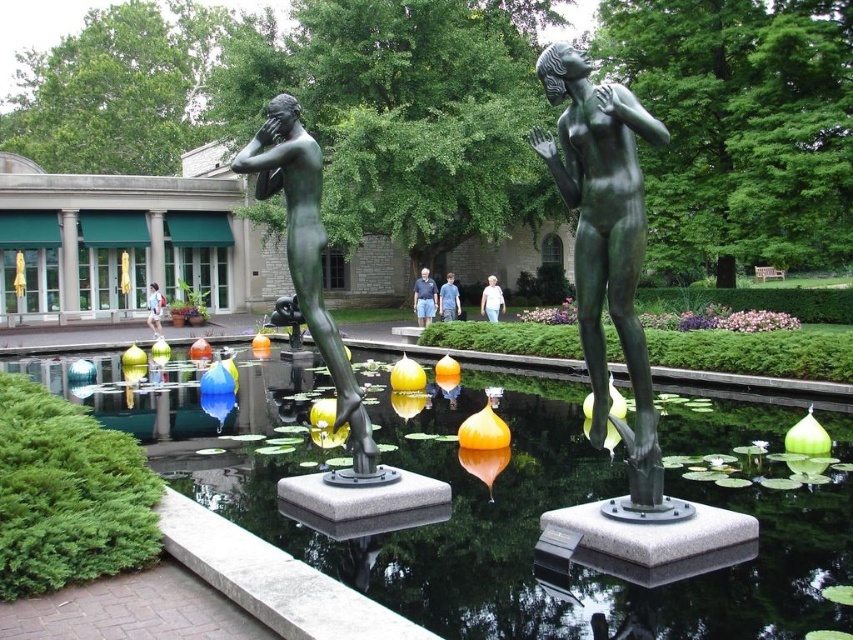
Is glossy concrete pond at center below blue jeans at center?

Indeed, glossy concrete pond at center is positioned under blue jeans at center.

This screenshot has height=640, width=853. Find the location of `glossy concrete pond at center`. glossy concrete pond at center is located at coordinates (505, 497).

You are a GUI agent. You are given a task and a screenshot of the screen. Output one action in this format:
    pyautogui.click(x=<x>, y=<y>)
    Task: Click on the glossy concrete pond at center
    This screenshot has width=853, height=640.
    Given the screenshot: What is the action you would take?
    pyautogui.click(x=505, y=497)

Is point (581, 198) positioned after point (155, 332)?

No, (581, 198) is in front of (155, 332).

Is green patina bronze statue at center below denim jacket at center?

Actually, green patina bronze statue at center is above denim jacket at center.

You are a GUI agent. You are given a task and a screenshot of the screen. Output one action in this format:
    pyautogui.click(x=<x>, y=<y>)
    Task: Click on the green patina bronze statue at center
    
    Given the screenshot: What is the action you would take?
    pyautogui.click(x=605, y=241)

Based on the photo, who is taller, white matte shirt at center or light blue jeans at center?

Standing taller between the two is light blue jeans at center.

Is point (479, 310) positioned in front of point (448, 316)?

No, it is not.

Who is more distant from viewer, (485, 308) or (451, 289)?

The point (485, 308) is more distant.

Identify the location of white matte shirt at center. This screenshot has width=853, height=640. (491, 300).